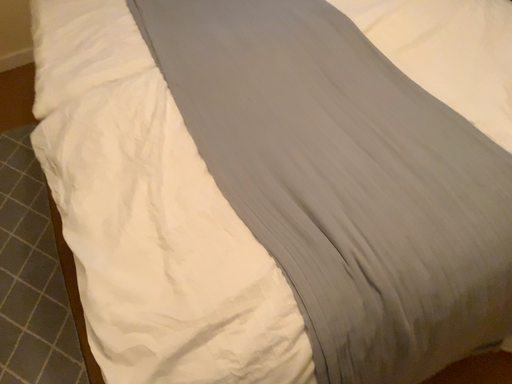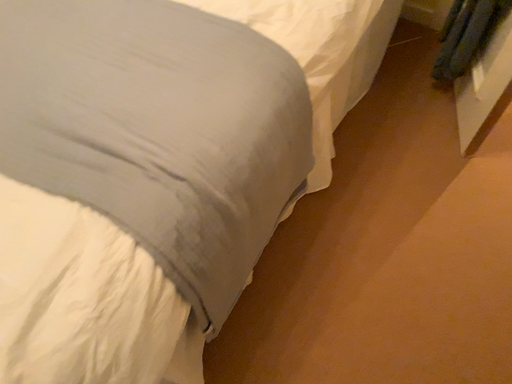
Question: How did the camera likely rotate when shooting the video?

Choices:
 (A) rotated right
 (B) rotated left

Answer: (A)